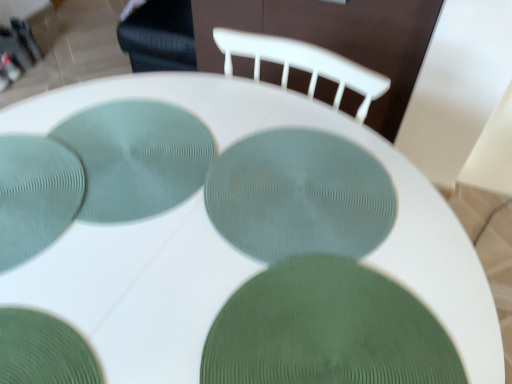
Identify the location of vacant point above matte green plate at center, placed as the second glass plate when sorted from right to left (from a real-world perspective). (305, 183).